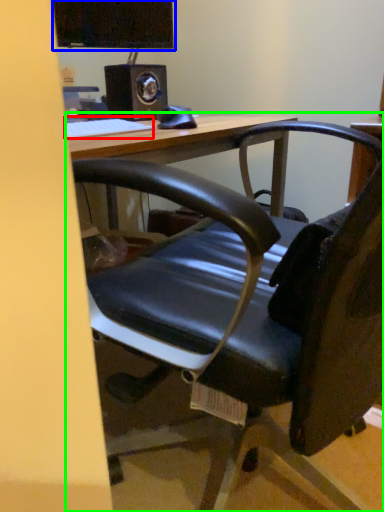
Question: Estimate the real-world distances between objects in this image. Which object is closer to keyboard (highlighted by a red box), computer monitor (highlighted by a blue box) or table (highlighted by a green box)?

Choices:
 (A) computer monitor
 (B) table

Answer: (B)